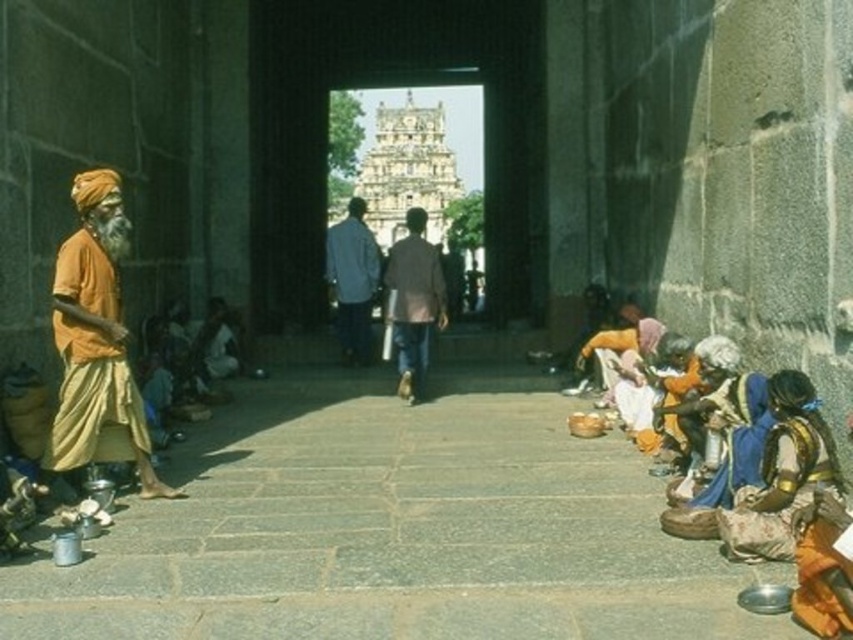
The height and width of the screenshot is (640, 853). Describe the element at coordinates (96, 342) in the screenshot. I see `orange cotton turban at left` at that location.

Which of these two, orange cotton turban at left or brown fabric jacket at center, stands shorter?

brown fabric jacket at center is shorter.

Locate an element on the screen. The image size is (853, 640). orange cotton turban at left is located at coordinates (96, 342).

Is orange cotton turban at left thinner than light blue shirt at center?

In fact, orange cotton turban at left might be wider than light blue shirt at center.

Is orange cotton turban at left positioned at the back of light blue shirt at center?

No, it is in front of light blue shirt at center.

What do you see at coordinates (96, 342) in the screenshot? I see `orange cotton turban at left` at bounding box center [96, 342].

In order to click on orange cotton turban at left in this screenshot , I will do `click(96, 342)`.

Between brown fabric jacket at center and light blue shirt at center, which one has less height?

Standing shorter between the two is light blue shirt at center.

Is brown fabric jacket at center positioned in front of light blue shirt at center?

Yes.

Who is more distant from viewer, (418, 292) or (340, 240)?

Point (340, 240)

Locate an element on the screen. brown fabric jacket at center is located at coordinates (415, 301).